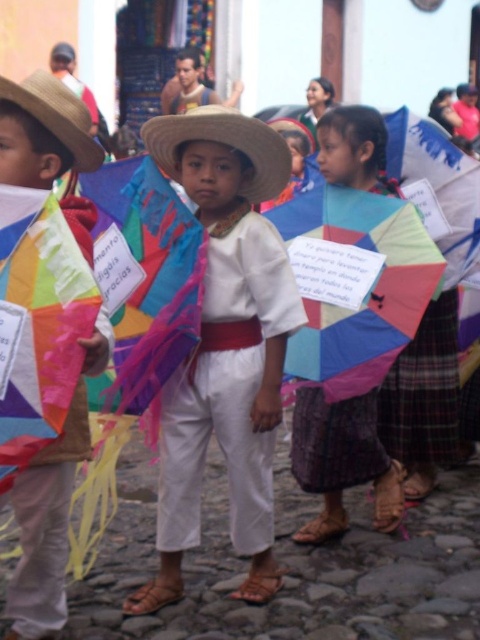
Question: Among these objects, which one is nearest to the camera?

Choices:
 (A) multicolored paper kite at center
 (B) white cotton shirt at center

Answer: (B)

Question: Can you confirm if white cotton shirt at center is positioned above matte straw hat at left?

Choices:
 (A) yes
 (B) no

Answer: (A)

Question: Considering the real-world distances, which object is closest to the multicolored paper kite at center?

Choices:
 (A) white cotton shirt at center
 (B) matte straw hat at left
 (C) natural straw hat at left

Answer: (A)

Question: Is white cotton shirt at center positioned behind multicolored paper kite at center?

Choices:
 (A) no
 (B) yes

Answer: (A)

Question: Is white cotton shirt at center wider than multicolored paper kite at center?

Choices:
 (A) yes
 (B) no

Answer: (A)

Question: Which point appears farthest from the camera in this image?

Choices:
 (A) (371, 458)
 (B) (200, 134)
 (C) (64, 595)
 (D) (72, 113)

Answer: (A)